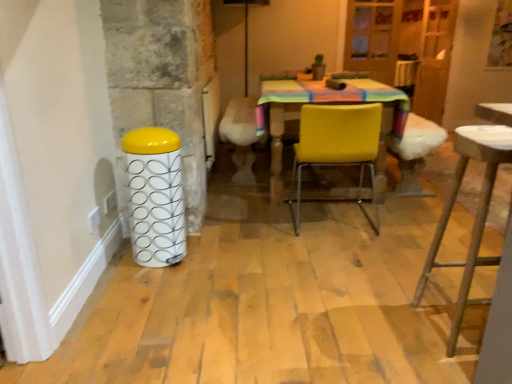
Question: Is yellow matte chair at center next to white glossy bar stool at left and touching it?

Choices:
 (A) no
 (B) yes

Answer: (A)

Question: Does yellow matte chair at center have a greater height compared to white glossy bar stool at left?

Choices:
 (A) no
 (B) yes

Answer: (B)

Question: Considering the relative sizes of yellow matte chair at center and white glossy bar stool at left in the image provided, is yellow matte chair at center bigger than white glossy bar stool at left?

Choices:
 (A) no
 (B) yes

Answer: (B)

Question: Would you say yellow matte chair at center is a long distance from white glossy bar stool at left?

Choices:
 (A) no
 (B) yes

Answer: (A)

Question: Considering the relative sizes of yellow matte chair at center and white glossy bar stool at left in the image provided, is yellow matte chair at center thinner than white glossy bar stool at left?

Choices:
 (A) yes
 (B) no

Answer: (B)

Question: Could white glossy bar stool at left be considered to be inside yellow matte chair at center?

Choices:
 (A) yes
 (B) no

Answer: (B)

Question: Can metallic stool at right be found inside white glossy bar stool at left?

Choices:
 (A) no
 (B) yes

Answer: (A)

Question: Does white glossy bar stool at left have a lesser width compared to metallic stool at right?

Choices:
 (A) yes
 (B) no

Answer: (A)

Question: Can you confirm if white glossy bar stool at left is wider than metallic stool at right?

Choices:
 (A) no
 (B) yes

Answer: (A)

Question: Is white glossy bar stool at left at the left side of metallic stool at right?

Choices:
 (A) no
 (B) yes

Answer: (B)

Question: Is white glossy bar stool at left facing towards metallic stool at right?

Choices:
 (A) no
 (B) yes

Answer: (A)

Question: Is white glossy bar stool at left next to metallic stool at right and touching it?

Choices:
 (A) yes
 (B) no

Answer: (B)

Question: Considering the relative positions of metallic stool at right and yellow matte chair at center in the image provided, is metallic stool at right behind yellow matte chair at center?

Choices:
 (A) yes
 (B) no

Answer: (B)